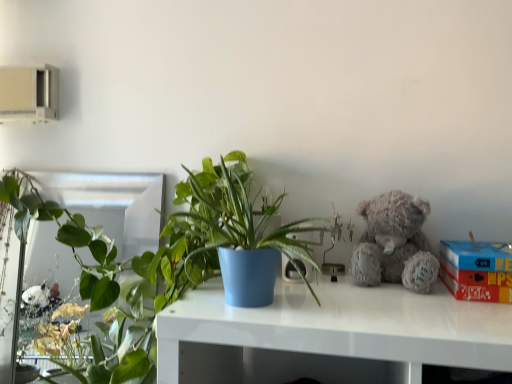
Question: Is green glossy plant at left, acting as the 1th houseplant starting from the left, taller or shorter than matte blue pot at center, acting as the first houseplant starting from the front?

Choices:
 (A) short
 (B) tall

Answer: (B)

Question: From the image's perspective, is green glossy plant at left, which is counted as the second houseplant, starting from the front, positioned above or below matte blue pot at center, the 2th houseplant from the back?

Choices:
 (A) below
 (B) above

Answer: (A)

Question: Considering the real-world distances, which object is farthest from the green glossy plant at left, which is the first houseplant from back to front?

Choices:
 (A) red cardboard box at right
 (B) fuzzy gray teddy bear at upper right
 (C) matte blue pot at center, the 1th houseplant when ordered from right to left

Answer: (A)

Question: Which object is positioned farthest from the red cardboard box at right?

Choices:
 (A) fuzzy gray teddy bear at upper right
 (B) matte blue pot at center, which is counted as the second houseplant, starting from the left
 (C) green glossy plant at left, the 2th houseplant from the right

Answer: (C)